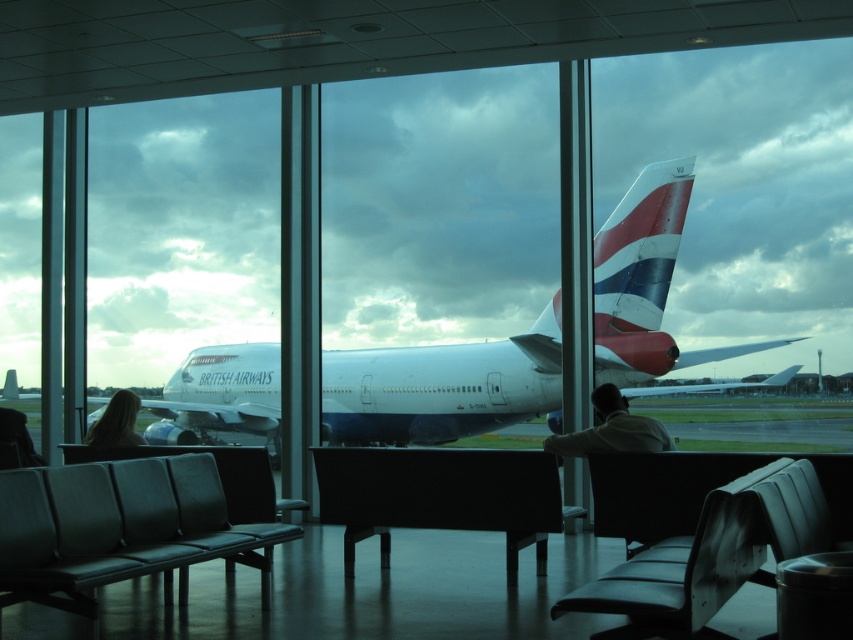
You are standing at the entrance of the airport terminal and want to locate the white glossy airplane at center. Based on the coordinates provided, in which direction should you walk to see it through the large windows?

The white glossy airplane at center is located at coordinates (442, 387). Since the coordinate system places (0, 0) at the bottom left corner, you should walk towards the right side of the windows to see the white glossy airplane at center.

You are a passenger sitting in the black fabric chair at center. You want to put your white shirt at center on the chair so it doesn not wrinkle. Should you fold it or can you just place it flat on the chair?

The black fabric chair at center might be wider than white shirt at center, so placing it flat on the chair should prevent wrinkles without needing to fold it.